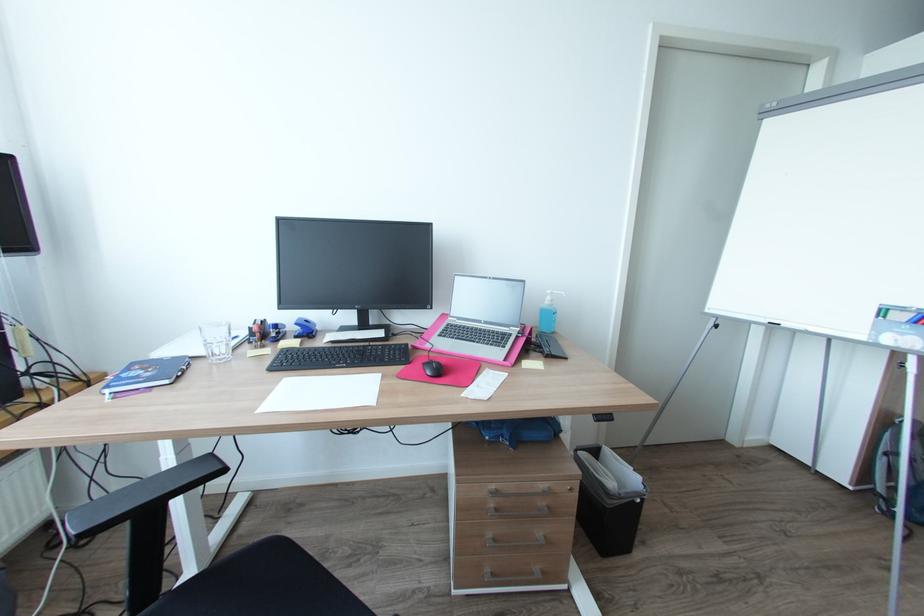
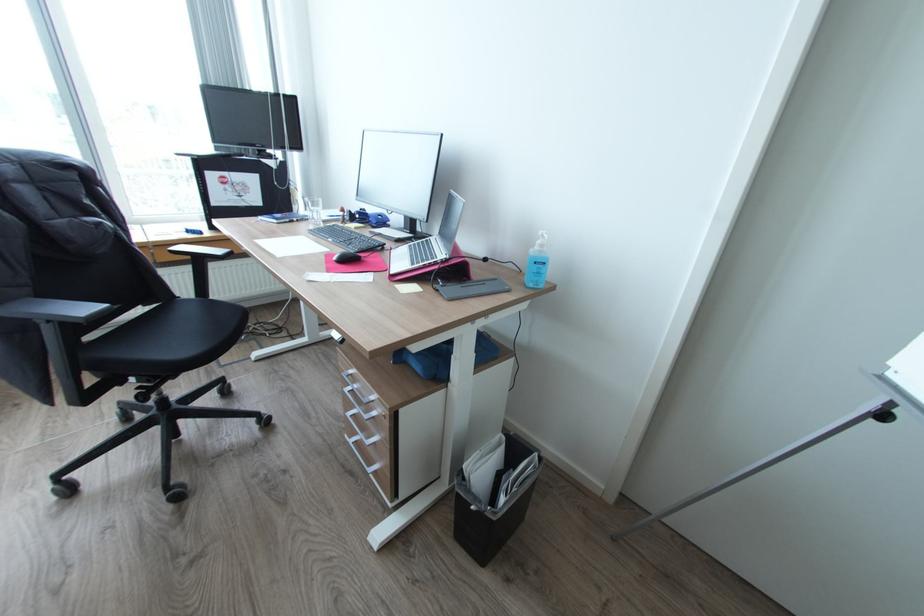
Find the pixel in the second image that matches point 453,325 in the first image.

(432, 238)